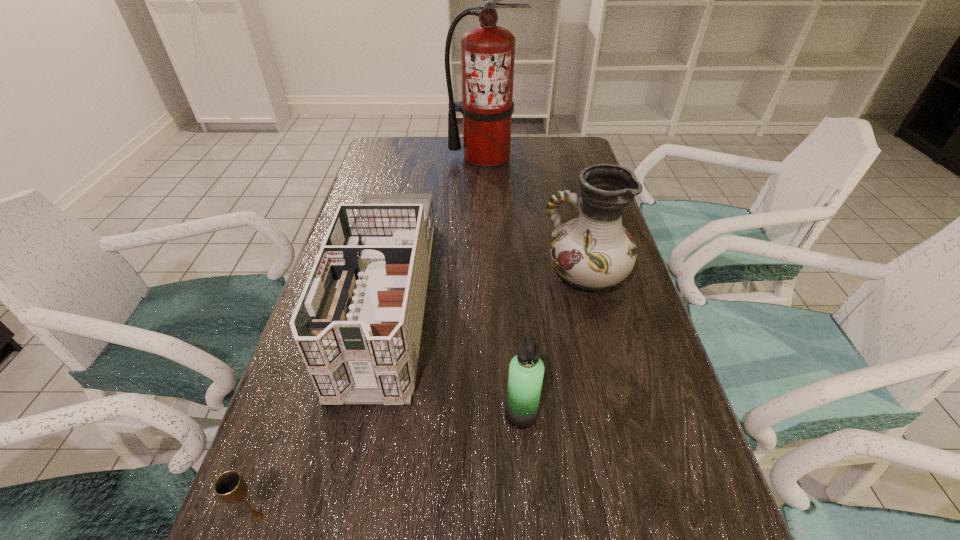
You are a GUI agent. You are given a task and a screenshot of the screen. Output one action in this format:
    pyautogui.click(x=<x>, y=<y>)
    Task: Click on the farthest object
    
    Given the screenshot: What is the action you would take?
    pyautogui.click(x=487, y=51)

You are a GUI agent. You are given a task and a screenshot of the screen. Output one action in this format:
    pyautogui.click(x=<x>, y=<y>)
    Task: Click on the tallest object
    This screenshot has height=540, width=960.
    Given the screenshot: What is the action you would take?
    pyautogui.click(x=487, y=51)

Identify the location of vase. The height and width of the screenshot is (540, 960). (592, 253).

At what (x,y) coordinates should I click in order to perform the action: click on the second tallest object. Please return your answer as a coordinate pair (x, y). Looking at the image, I should click on (592, 253).

The height and width of the screenshot is (540, 960). I want to click on thermos bottle, so click(x=526, y=370).

Locate an element on the screen. The height and width of the screenshot is (540, 960). dollhouse is located at coordinates pos(358,322).

Locate an element on the screen. Image resolution: width=960 pixels, height=540 pixels. the shortest object is located at coordinates (231, 487).

Identify the location of the leftmost object. This screenshot has height=540, width=960. (231, 487).

Find the location of a particular element. The width and height of the screenshot is (960, 540). free space located toward the nozzle of the fire extinguisher is located at coordinates (486, 211).

At what (x,y) coordinates should I click in order to perform the action: click on vacant point located 0.370m on the front of the rightmost object. Please return your answer as a coordinate pair (x, y). Image resolution: width=960 pixels, height=540 pixels. Looking at the image, I should click on (633, 463).